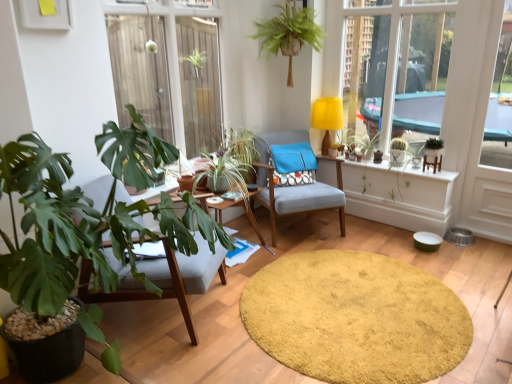
I want to click on free point below yellow shaggy rug at center (from a real-world perspective), so click(x=351, y=299).